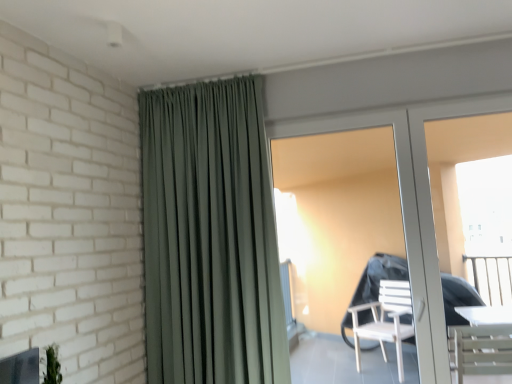
Locate an element on the screen. This screenshot has height=384, width=512. white glossy door at center is located at coordinates (411, 204).

The width and height of the screenshot is (512, 384). Describe the element at coordinates (432, 215) in the screenshot. I see `white glossy screen door at right` at that location.

You are a GUI agent. You are given a task and a screenshot of the screen. Output one action in this format:
    pyautogui.click(x=<x>, y=<y>)
    Task: Click on the satin green curtain at upper center
    
    Given the screenshot: What is the action you would take?
    pyautogui.click(x=210, y=237)

Is white glossy screen door at right next to white glossy door at center?

Yes, white glossy screen door at right is with white glossy door at center.

Which is closer, (426, 157) or (453, 111)?

The point (453, 111) is in front.

In terms of size, does white glossy screen door at right appear bigger or smaller than white glossy door at center?

In the image, white glossy screen door at right appears to be smaller than white glossy door at center.

From the image's perspective, is white glossy door at center positioned above or below satin green curtain at upper center?

white glossy door at center is situated lower than satin green curtain at upper center in the image.

Between white glossy door at center and satin green curtain at upper center, which one has smaller size?

Smaller between the two is white glossy door at center.

From a real-world perspective, is white glossy door at center on satin green curtain at upper center?

No, from a real-world perspective, white glossy door at center is not above satin green curtain at upper center.

Considering the positions of objects white glossy door at center and satin green curtain at upper center in the image provided, who is more to the right, white glossy door at center or satin green curtain at upper center?

From the viewer's perspective, white glossy door at center appears more on the right side.

Is white glossy door at center oriented away from white glossy screen door at right?

Yes, white glossy door at center is positioned with its back facing white glossy screen door at right.

From a real-world perspective, is white glossy door at center located higher than white glossy screen door at right?

Yes, from a real-world perspective, white glossy door at center is above white glossy screen door at right.

Find the location of `screen door that appears on the right of white glossy door at center`. screen door that appears on the right of white glossy door at center is located at coordinates (432, 215).

Is white glossy screen door at right inside white glossy door at center?

Indeed, white glossy screen door at right is located within white glossy door at center.

Is satin green curtain at upper center looking in the opposite direction of white glossy door at center?

No.

Considering the positions of objects satin green curtain at upper center and white glossy door at center in the image provided, who is more to the right, satin green curtain at upper center or white glossy door at center?

white glossy door at center.

Is satin green curtain at upper center taller or shorter than white glossy door at center?

satin green curtain at upper center is taller than white glossy door at center.

From a real-world perspective, who is located lower, satin green curtain at upper center or white glossy door at center?

white glossy door at center.

Is satin green curtain at upper center turned away from white glossy screen door at right?

No, satin green curtain at upper center's orientation is not away from white glossy screen door at right.

Considering the sizes of satin green curtain at upper center and white glossy screen door at right in the image, is satin green curtain at upper center taller or shorter than white glossy screen door at right?

Considering their sizes, satin green curtain at upper center has more height than white glossy screen door at right.

Is satin green curtain at upper center to the left or to the right of white glossy screen door at right in the image?

In the image, satin green curtain at upper center appears on the left side of white glossy screen door at right.

Between satin green curtain at upper center and white glossy screen door at right, which one has larger width?

satin green curtain at upper center is wider.

Is white glossy screen door at right wider or thinner than satin green curtain at upper center?

In the image, white glossy screen door at right appears to be more narrow than satin green curtain at upper center.

From a real-world perspective, is white glossy screen door at right below satin green curtain at upper center?

Yes, from a real-world perspective, white glossy screen door at right is below satin green curtain at upper center.

Measure the distance from white glossy screen door at right to satin green curtain at upper center.

white glossy screen door at right and satin green curtain at upper center are 1.21 meters apart from each other.

Is white glossy screen door at right located outside satin green curtain at upper center?

Absolutely, white glossy screen door at right is external to satin green curtain at upper center.

Where is `door on the left of white glossy screen door at right`? The image size is (512, 384). door on the left of white glossy screen door at right is located at coordinates (411, 204).

Identify the location of door on the right of satin green curtain at upper center. The image size is (512, 384). (411, 204).

When comparing their distances from white glossy screen door at right, does satin green curtain at upper center or white glossy door at center seem closer?

white glossy door at center lies closer to white glossy screen door at right than the other object.

When comparing their distances from white glossy door at center, does white glossy screen door at right or satin green curtain at upper center seem closer?

Based on the image, white glossy screen door at right appears to be nearer to white glossy door at center.

Looking at the image, which one is located further to white glossy screen door at right, white glossy door at center or satin green curtain at upper center?

satin green curtain at upper center is further to white glossy screen door at right.

Looking at the image, which one is located further to satin green curtain at upper center, white glossy door at center or white glossy screen door at right?

white glossy screen door at right is further to satin green curtain at upper center.

Estimate the real-world distances between objects in this image. Which object is closer to satin green curtain at upper center, white glossy screen door at right or white glossy door at center?

The object closer to satin green curtain at upper center is white glossy door at center.

Considering their positions, is satin green curtain at upper center positioned closer to white glossy door at center than white glossy screen door at right?

white glossy screen door at right.

Image resolution: width=512 pixels, height=384 pixels. Find the location of `door between satin green curtain at upper center and white glossy screen door at right in the horizontal direction`. door between satin green curtain at upper center and white glossy screen door at right in the horizontal direction is located at coordinates (411, 204).